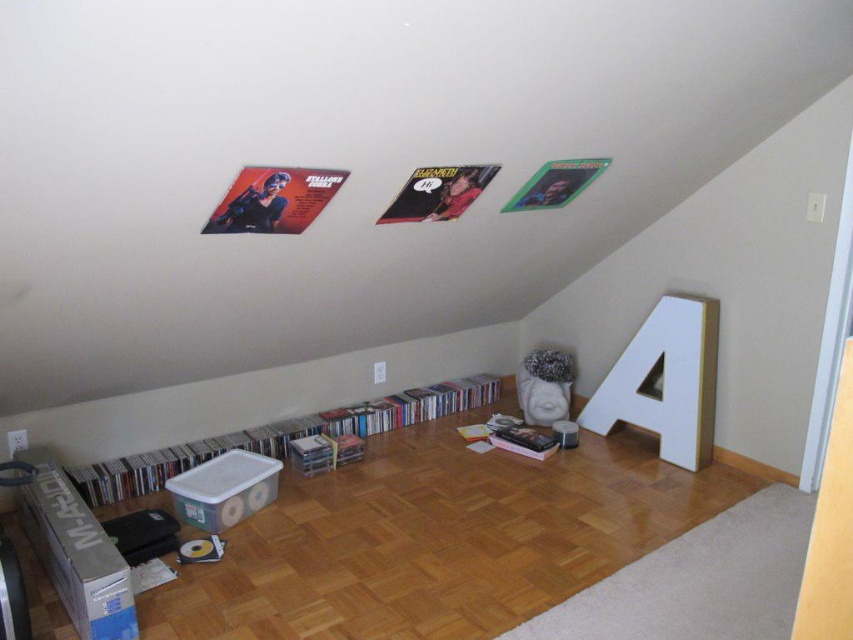
Question: Which of the following is the farthest from the observer?

Choices:
 (A) (640, 426)
 (B) (454, 392)

Answer: (B)

Question: Does white matte letter a at right appear over clear plastic storage at lower center?

Choices:
 (A) yes
 (B) no

Answer: (A)

Question: In this image, where is white matte letter a at right located relative to clear plastic storage at lower center?

Choices:
 (A) above
 (B) below

Answer: (A)

Question: Is white matte letter a at right smaller than clear plastic storage at lower center?

Choices:
 (A) no
 (B) yes

Answer: (B)

Question: Among these objects, which one is nearest to the camera?

Choices:
 (A) clear plastic storage at lower center
 (B) white matte letter a at right

Answer: (A)